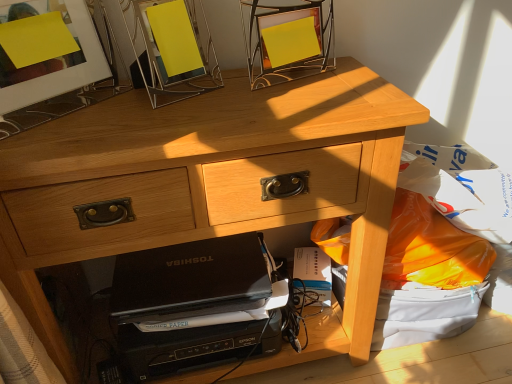
Question: Relative to light wood desk at center, is matte glass picture frame at upper left, acting as the 2th picture frame starting from the right, in front or behind?

Choices:
 (A) behind
 (B) front

Answer: (B)

Question: From a real-world perspective, relative to light wood desk at center, is matte glass picture frame at upper left, the first picture frame in the left-to-right sequence, vertically above or below?

Choices:
 (A) above
 (B) below

Answer: (A)

Question: Based on their relative distances, which object is nearer to the black matte laptop at lower center?

Choices:
 (A) metallic silver picture frame at upper center, marked as the 1th picture frame in a right-to-left arrangement
 (B) light wood desk at center
 (C) white paper at lower center
 (D) matte glass picture frame at upper left, acting as the 2th picture frame starting from the right

Answer: (B)

Question: Based on their relative distances, which object is nearer to the metallic silver picture frame at upper center, positioned as the second picture frame in left-to-right order?

Choices:
 (A) matte glass picture frame at upper left, the first picture frame in the left-to-right sequence
 (B) white paper at lower center
 (C) light wood desk at center
 (D) black matte laptop at lower center

Answer: (A)